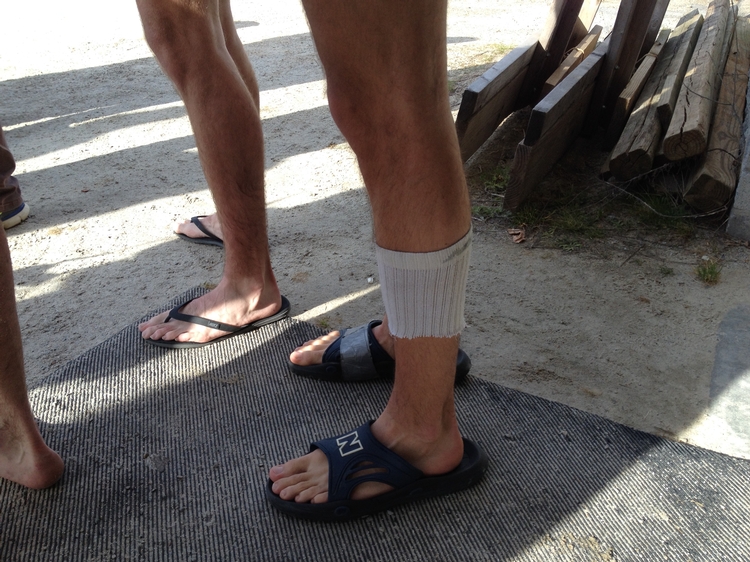
The height and width of the screenshot is (562, 750). I want to click on wood boards, so click(x=727, y=213), click(x=714, y=166), click(x=688, y=130), click(x=640, y=131), click(x=600, y=96), click(x=514, y=85).